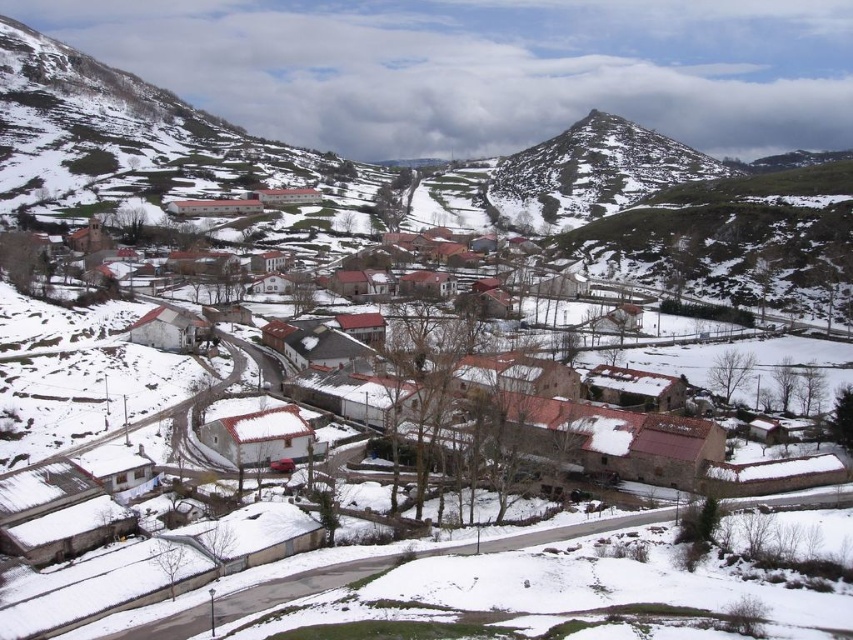
Question: From the image, what is the correct spatial relationship of white stone houses at center in relation to green grassy peak at upper right?

Choices:
 (A) above
 (B) below

Answer: (B)

Question: Can you confirm if white stone houses at center is positioned to the left of green grassy peak at upper right?

Choices:
 (A) no
 (B) yes

Answer: (B)

Question: Where is white stone houses at center located in relation to green grassy peak at upper right in the image?

Choices:
 (A) above
 (B) below

Answer: (B)

Question: Which object appears farthest from the camera in this image?

Choices:
 (A) green grassy peak at upper right
 (B) white stone houses at center

Answer: (A)